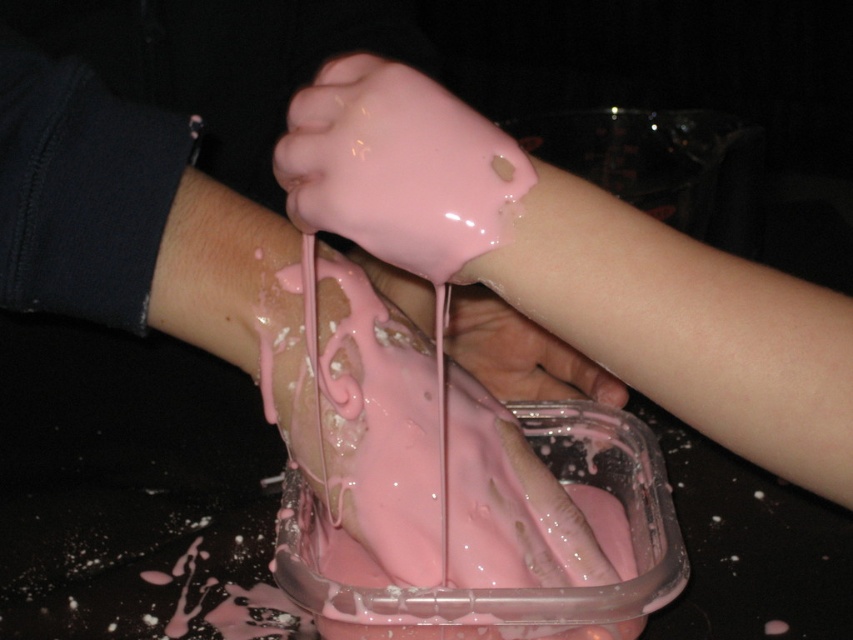
Question: Does pink glossy frosting at center appear under pink glossy hand at center?

Choices:
 (A) yes
 (B) no

Answer: (A)

Question: Observing the image, what is the correct spatial positioning of pink glossy frosting at center in reference to pink glossy hand at center?

Choices:
 (A) above
 (B) below

Answer: (B)

Question: Observing the image, what is the correct spatial positioning of pink glossy frosting at center in reference to pink glossy hand at center?

Choices:
 (A) right
 (B) left

Answer: (B)

Question: Which of the following is the closest to the observer?

Choices:
 (A) pink glossy hand at center
 (B) pink glossy frosting at center

Answer: (B)

Question: Which point appears farthest from the camera in this image?

Choices:
 (A) (396, 492)
 (B) (473, 356)

Answer: (B)